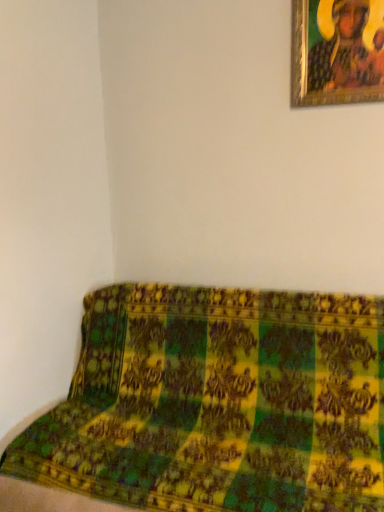
Question: From a real-world perspective, relative to green fabric couch at lower right, is gold-framed painting at upper right vertically above or below?

Choices:
 (A) below
 (B) above

Answer: (B)

Question: From the image's perspective, is gold-framed painting at upper right located above or below green fabric couch at lower right?

Choices:
 (A) below
 (B) above

Answer: (B)

Question: Is gold-framed painting at upper right spatially inside green fabric couch at lower right, or outside of it?

Choices:
 (A) inside
 (B) outside

Answer: (B)

Question: In terms of height, does green fabric couch at lower right look taller or shorter compared to gold-framed painting at upper right?

Choices:
 (A) tall
 (B) short

Answer: (A)

Question: From the image's perspective, is green fabric couch at lower right positioned above or below gold-framed painting at upper right?

Choices:
 (A) below
 (B) above

Answer: (A)

Question: In the image, is green fabric couch at lower right on the left side or the right side of gold-framed painting at upper right?

Choices:
 (A) right
 (B) left

Answer: (B)

Question: From a real-world perspective, relative to gold-framed painting at upper right, is green fabric couch at lower right vertically above or below?

Choices:
 (A) above
 (B) below

Answer: (B)